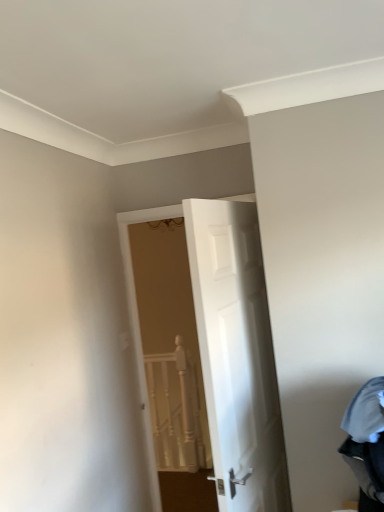
Question: In terms of width, does white textured rail at center look wider or thinner when compared to white glossy door at center?

Choices:
 (A) wide
 (B) thin

Answer: (B)

Question: Is white textured rail at center to the left or to the right of white glossy door at center in the image?

Choices:
 (A) right
 (B) left

Answer: (B)

Question: Which object is the farthest from the white textured rail at center?

Choices:
 (A) denim fabric laundry at lower right
 (B) white glossy door at center

Answer: (A)

Question: Which object is the farthest from the white glossy door at center?

Choices:
 (A) denim fabric laundry at lower right
 (B) white textured rail at center

Answer: (B)